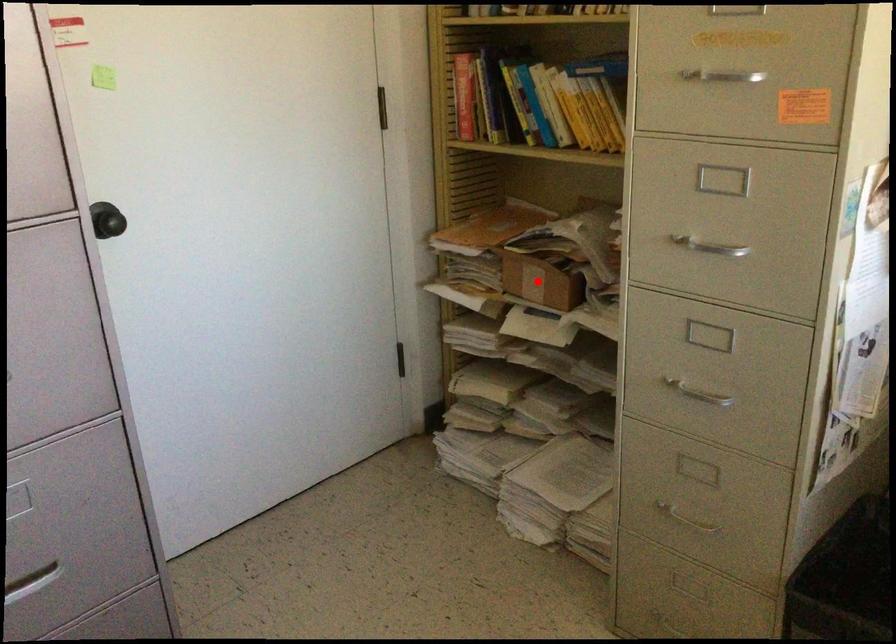
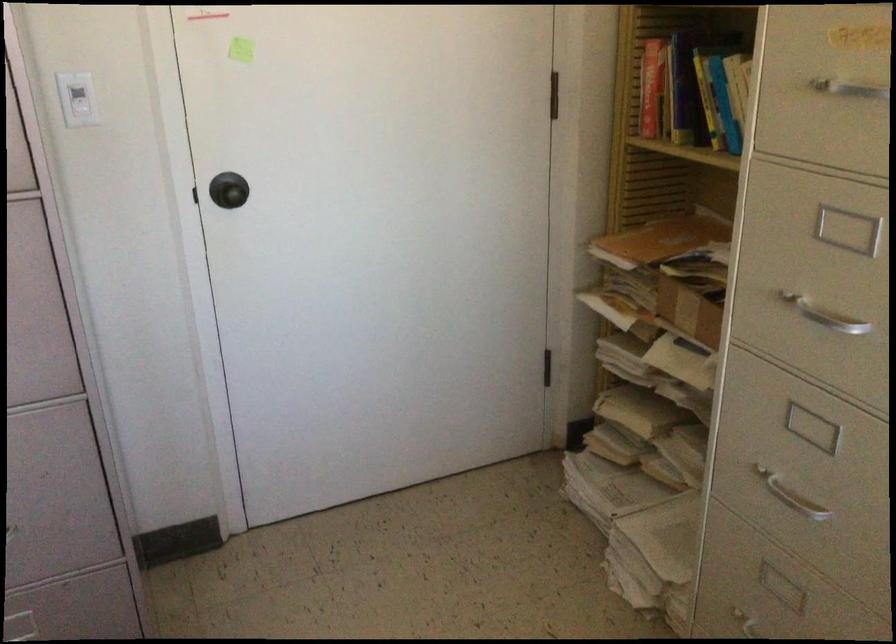
The point at the highlighted location is marked in the first image. Where is the corresponding point in the second image?

(688, 310)